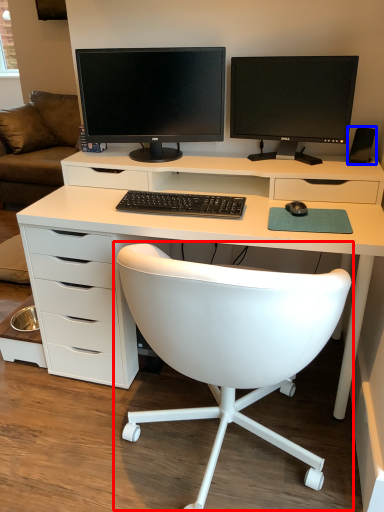
Question: Which point is closer to the camera, chair (highlighted by a red box) or speaker (highlighted by a blue box)?

Choices:
 (A) chair
 (B) speaker

Answer: (A)